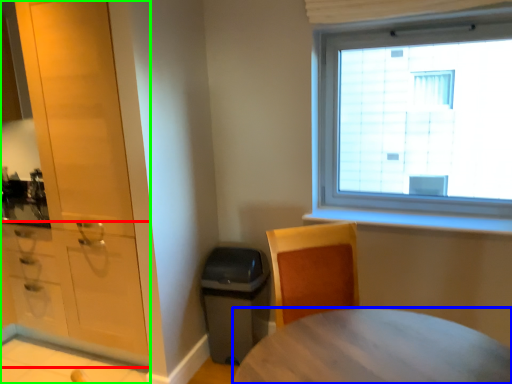
Question: Estimate the real-world distances between objects in this image. Which object is farther from cabinetry (highlighted by a red box), desk (highlighted by a blue box) or cabinetry (highlighted by a green box)?

Choices:
 (A) desk
 (B) cabinetry

Answer: (A)